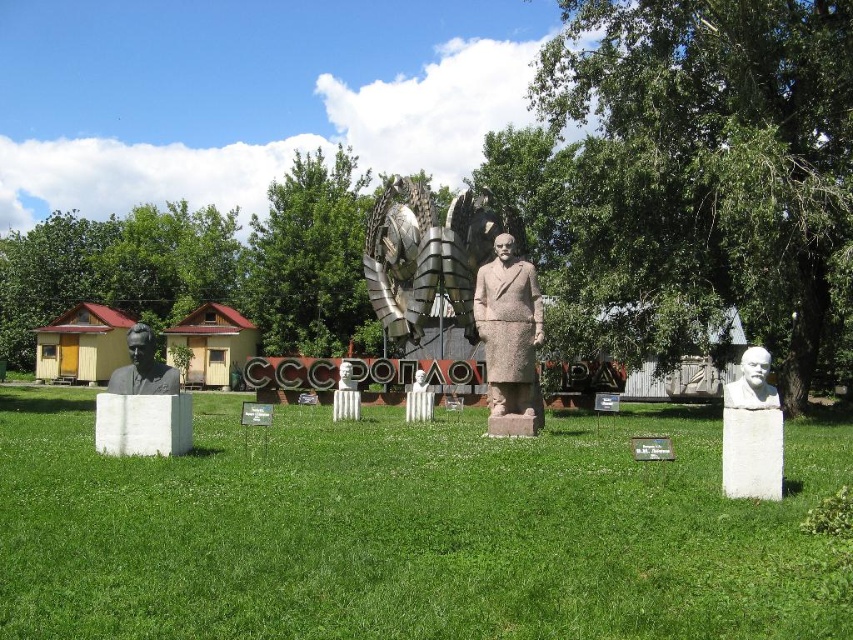
Consider the image. You are an art student analyzing the statues in the scene. You notice two white marble busts on pedestals. Which of the two, the white marble bust at left or the white marble bust at center, has a narrower width?

The white marble bust at left is thinner than the white marble bust at center, so it has a narrower width.

You are a tour guide leading a group towards the gray stone statue at center and the white marble bust at left. Which object should you point out first to your group as they approach the scene?

You should point out the gray stone statue at center first because it is closer to the viewer than the white marble bust at left, making it more prominent in the foreground.